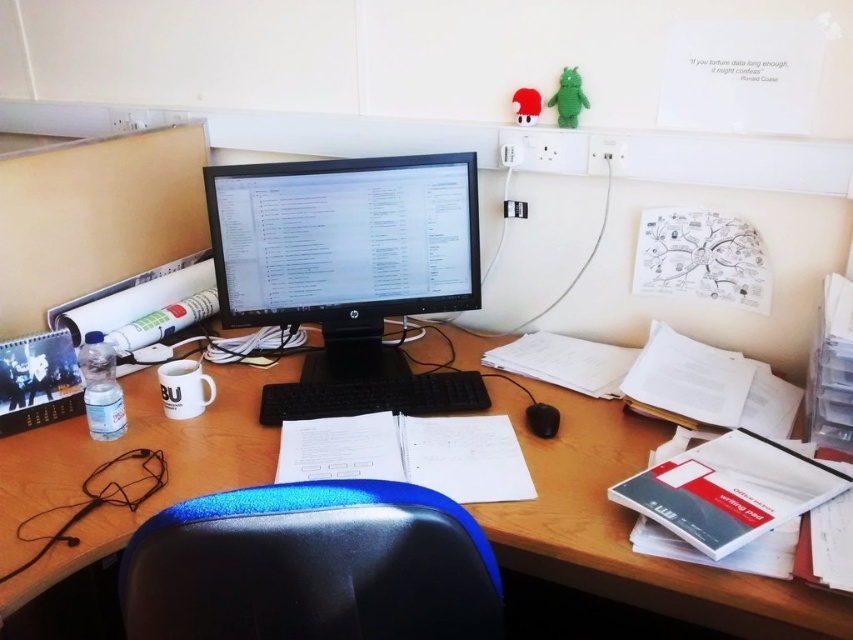
Question: Can you confirm if blue textured swivel chair at center is smaller than black plastic keyboard at center?

Choices:
 (A) no
 (B) yes

Answer: (A)

Question: Does wooden at center have a smaller size compared to blue textured swivel chair at center?

Choices:
 (A) no
 (B) yes

Answer: (A)

Question: Considering the real-world distances, which object is closest to the black glossy monitor at center?

Choices:
 (A) blue textured swivel chair at center
 (B) black plastic keyboard at center
 (C) wooden at center
 (D) black matte mouse at center

Answer: (B)

Question: Does blue textured swivel chair at center appear under black matte mouse at center?

Choices:
 (A) no
 (B) yes

Answer: (B)

Question: Based on their relative distances, which object is nearer to the wooden at center?

Choices:
 (A) black plastic keyboard at center
 (B) black glossy monitor at center
 (C) blue textured swivel chair at center

Answer: (A)

Question: Which object appears farthest from the camera in this image?

Choices:
 (A) blue textured swivel chair at center
 (B) black matte mouse at center
 (C) wooden at center
 (D) black glossy monitor at center

Answer: (D)